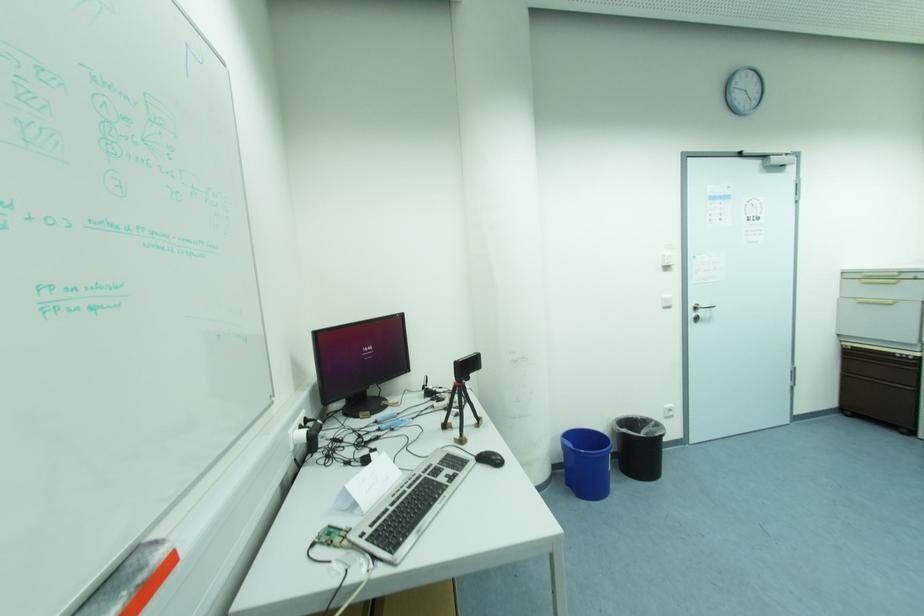
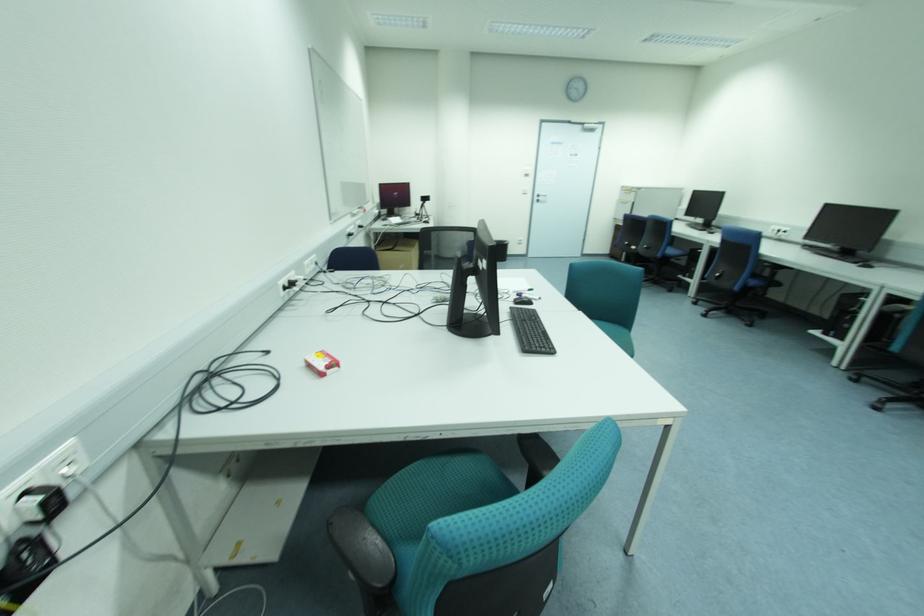
Question: The images are taken continuously from a first-person perspective. In which direction are you moving?

Choices:
 (A) Left
 (B) Right
 (C) Forward
 (D) Backward

Answer: (D)